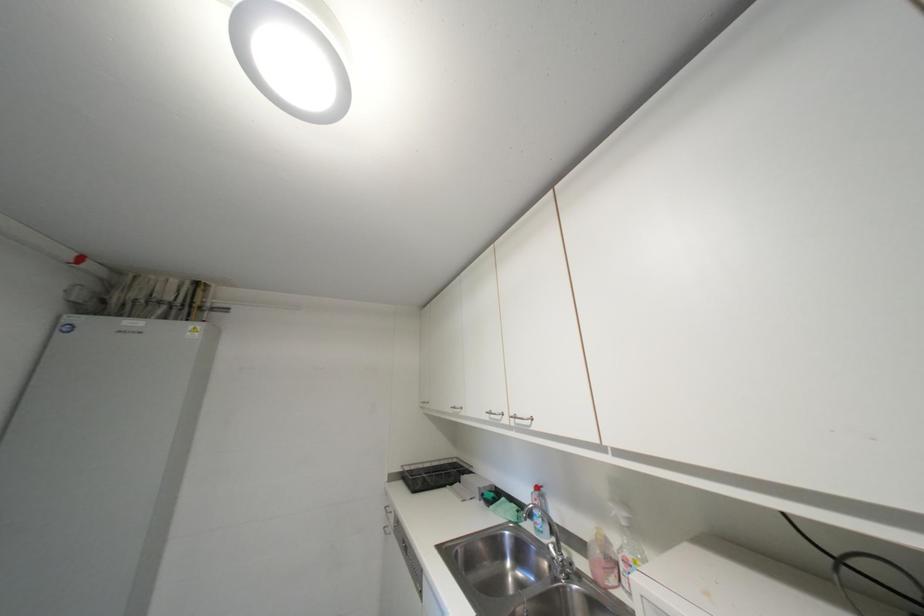
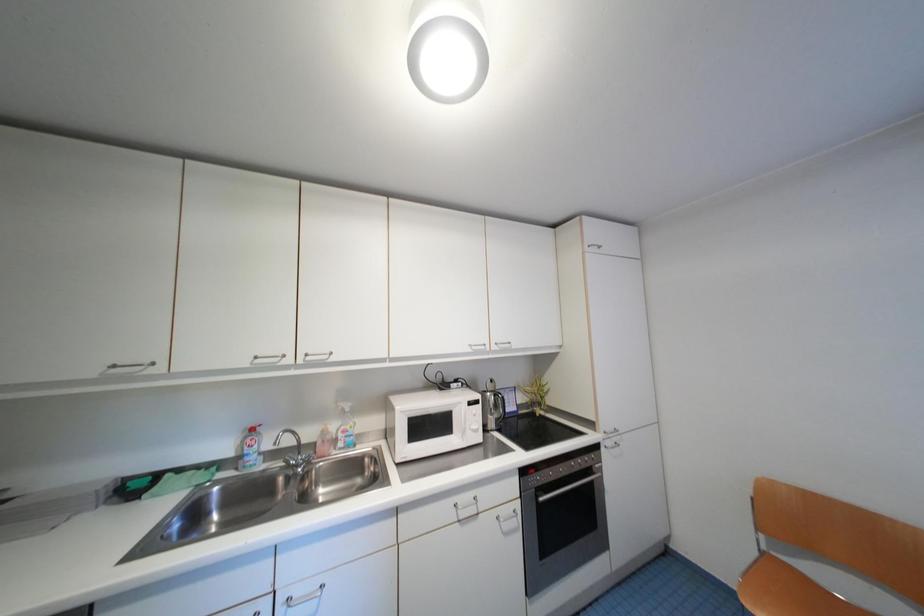
Question: The images are taken continuously from a first-person perspective. In which direction is your viewpoint rotating?

Choices:
 (A) Left
 (B) Right
 (C) Up
 (D) Down

Answer: (B)